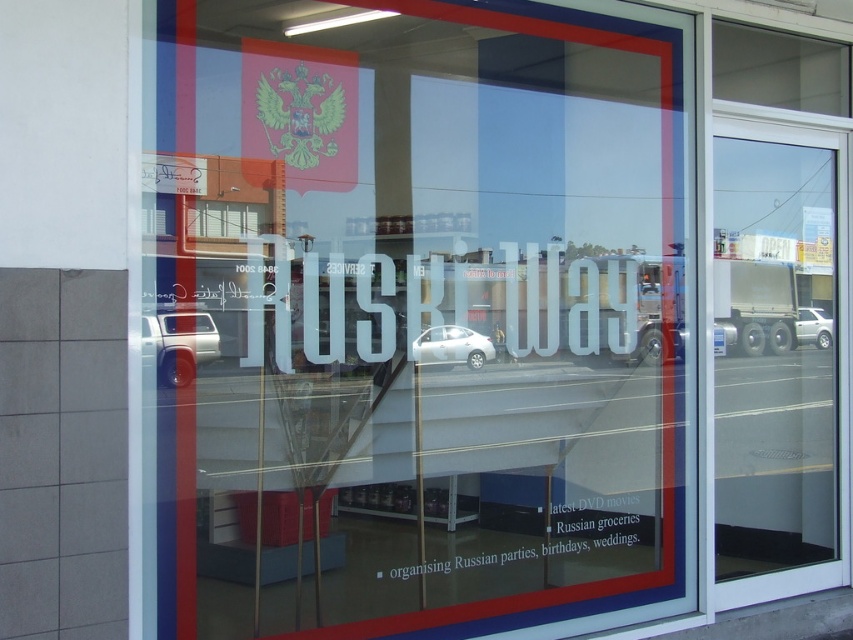
You are standing in front of the storefront window and see two points marked in the image. The first point is at coordinates point [165,330] and the second point is at point [807,317]. Which point is closer to you?

Point [165,330] is closer to the viewer than point [807,317].

Consider the image. You are a delivery person approaching the storefront. You see the transparent glass door at right and the silver metallic car at right. Which object is larger in size?

The transparent glass door at right is bigger than the silver metallic car at right according to the description.